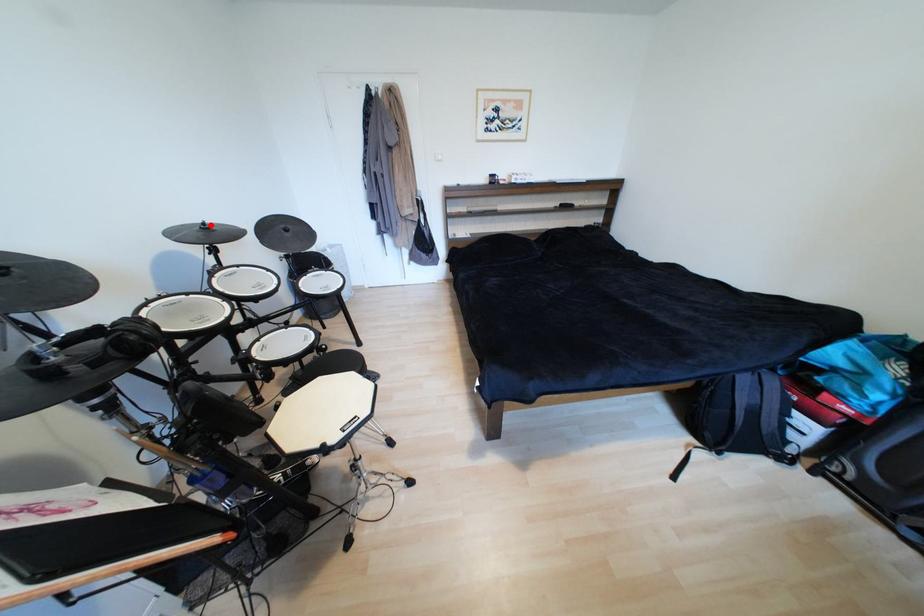
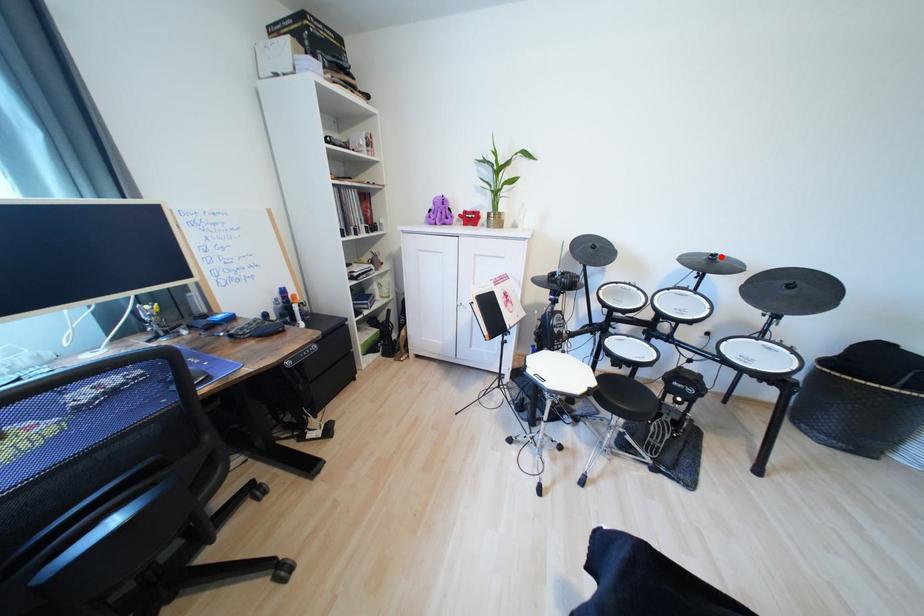
I am providing you with two images of the same scene from different viewpoints. A red point is marked on the first image and another point is marked on the second image. Do the highlighted points in image1 and image2 indicate the same real-world spot?

Yes